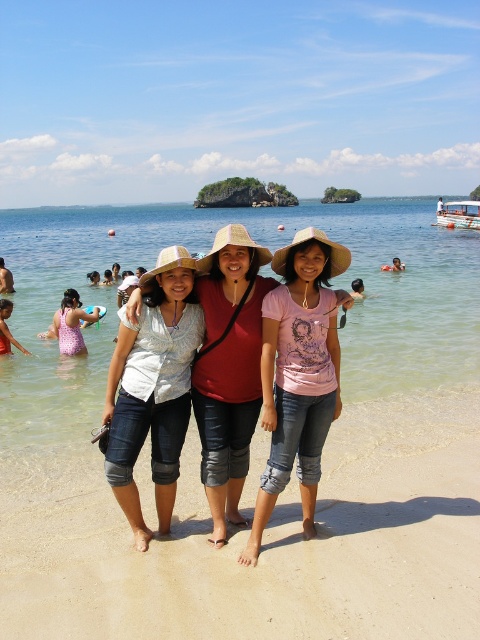
You are a photographer trying to capture a clear shot of the pink fabric swimsuit at left and the denim jeans at center. Since you want to focus on the smaller object, which one should you zoom in on?

The pink fabric swimsuit at left is smaller than the denim jeans at center, so you should zoom in on the pink fabric swimsuit at left to focus on the smaller object.

You are a photographer taking a picture of the beach scene. You notice the denim jeans at center and the pink fabric swimsuit at left. Which clothing item is positioned more to the left?

The pink fabric swimsuit at left is positioned more to the left than the denim jeans at center.